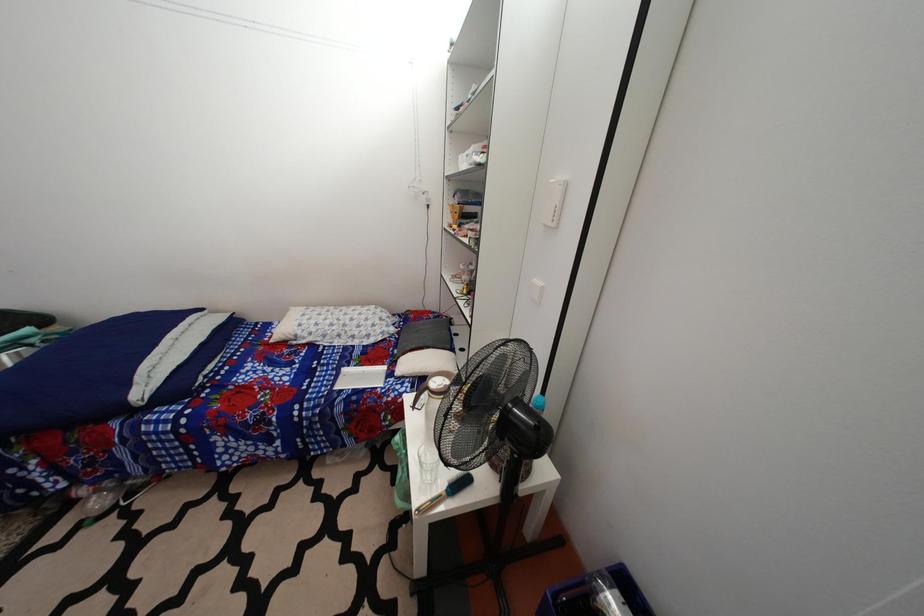
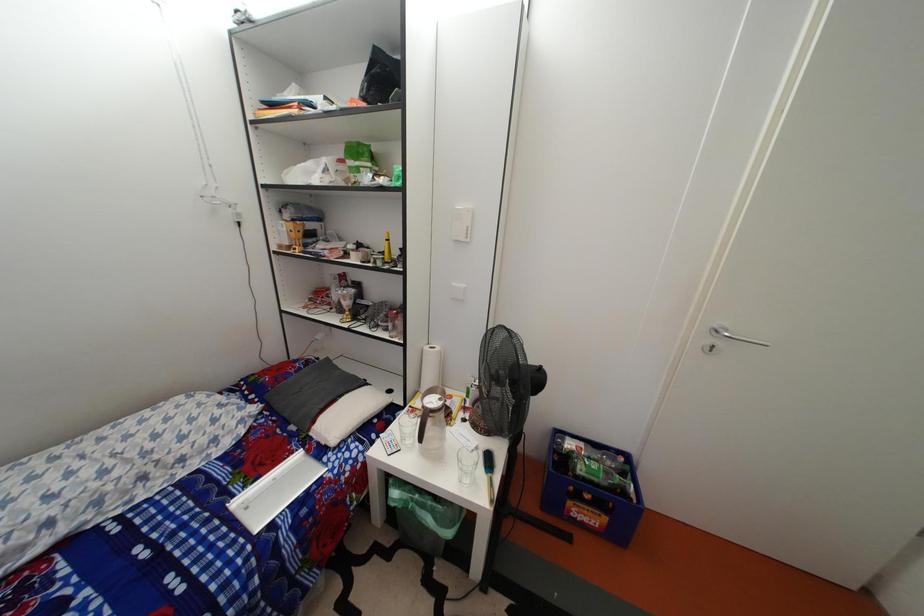
Question: The camera is either moving clockwise (left) or counter-clockwise (right) around the object. The first image is from the beginning of the video and the second image is from the end. Is the camera moving left or right when shooting the video?

Choices:
 (A) Left
 (B) Right

Answer: (A)